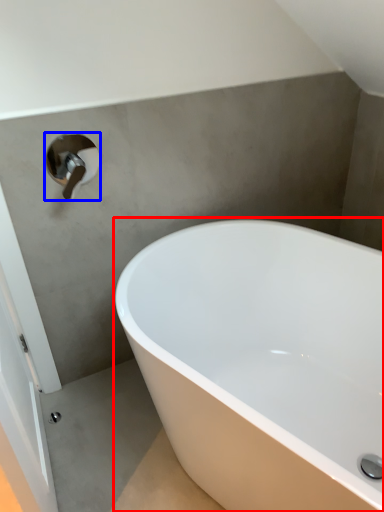
Question: Which object is further to the camera taking this photo, bathtub (highlighted by a red box) or tap (highlighted by a blue box)?

Choices:
 (A) bathtub
 (B) tap

Answer: (B)